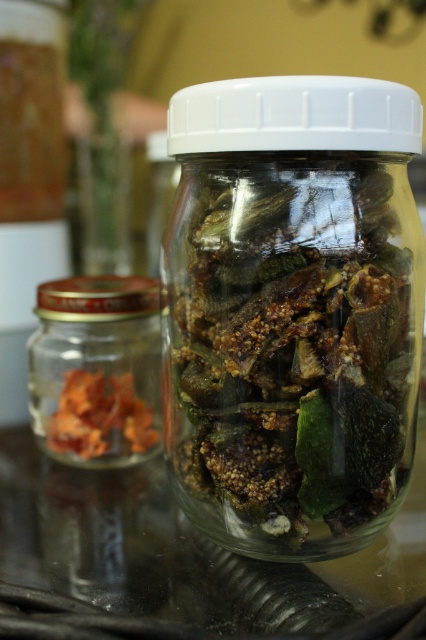
Looking at this image, between brown matte dried figs at center and translucent glass jar at left, which one has less height?

Standing shorter between the two is translucent glass jar at left.

Does brown matte dried figs at center appear on the left side of translucent glass jar at left?

In fact, brown matte dried figs at center is to the right of translucent glass jar at left.

What do you see at coordinates (291, 349) in the screenshot? I see `brown matte dried figs at center` at bounding box center [291, 349].

Where is `brown matte dried figs at center`? Image resolution: width=426 pixels, height=640 pixels. brown matte dried figs at center is located at coordinates (291, 349).

Is translucent glass jar at left smaller than orange dried leaves at left?

Incorrect, translucent glass jar at left is not smaller in size than orange dried leaves at left.

The width and height of the screenshot is (426, 640). What do you see at coordinates (95, 369) in the screenshot?
I see `translucent glass jar at left` at bounding box center [95, 369].

Consider the image. Who is more distant from viewer, [126,340] or [123,410]?

The point [126,340] is behind.

Where is `translucent glass jar at left`? Image resolution: width=426 pixels, height=640 pixels. translucent glass jar at left is located at coordinates (95, 369).

Does brown matte dried figs at center appear on the right side of orange dried leaves at left?

Yes, brown matte dried figs at center is to the right of orange dried leaves at left.

Between point (302, 176) and point (138, 400), which one is positioned behind?

The point (138, 400) is behind.

Between point (250, 211) and point (94, 451), which one is positioned behind?

Point (94, 451)

Identify the location of brown matte dried figs at center. The height and width of the screenshot is (640, 426). (291, 349).